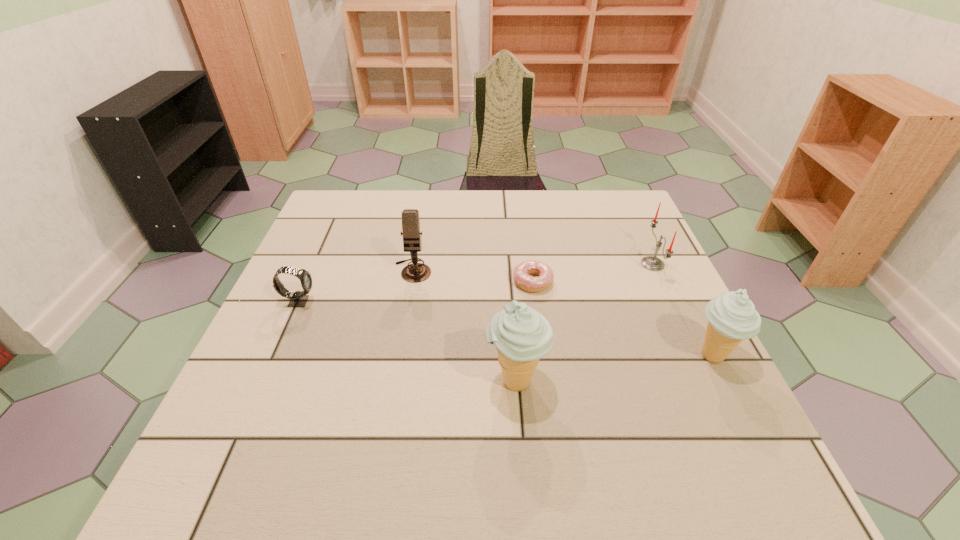
This screenshot has height=540, width=960. What are the coordinates of `vacant space that's between the right icecream and the doughnut` in the screenshot? It's located at (x=623, y=319).

Locate an element on the screen. This screenshot has width=960, height=540. vacant space that's between the shorter icecream and the tallest object is located at coordinates (614, 368).

At what (x,y) coordinates should I click in order to perform the action: click on the second closest object to the shortest object. Please return your answer as a coordinate pair (x, y). Image resolution: width=960 pixels, height=540 pixels. Looking at the image, I should click on (417, 272).

This screenshot has height=540, width=960. In order to click on the third closest object to the tallest object in this screenshot , I will do `click(732, 317)`.

Where is `vacant space that satisfies the following two spatial constraints: 1. on the front-facing side of the candle; 2. on the front side of the tallest object`? This screenshot has width=960, height=540. vacant space that satisfies the following two spatial constraints: 1. on the front-facing side of the candle; 2. on the front side of the tallest object is located at coordinates (708, 381).

Locate an element on the screen. Image resolution: width=960 pixels, height=540 pixels. free spot that satisfies the following two spatial constraints: 1. on the front-facing side of the third shortest object; 2. on the front-facing side of the microphone is located at coordinates (656, 270).

Locate an element on the screen. vacant area in the image that satisfies the following two spatial constraints: 1. on the back side of the left icecream; 2. on the right side of the right icecream is located at coordinates (514, 355).

I want to click on free space that satisfies the following two spatial constraints: 1. on the front-facing side of the shorter icecream; 2. on the left side of the second object from left to right, so click(x=397, y=355).

Locate an element on the screen. The width and height of the screenshot is (960, 540). free space that satisfies the following two spatial constraints: 1. on the front-facing side of the third shortest object; 2. on the front-facing side of the second object from left to right is located at coordinates (656, 270).